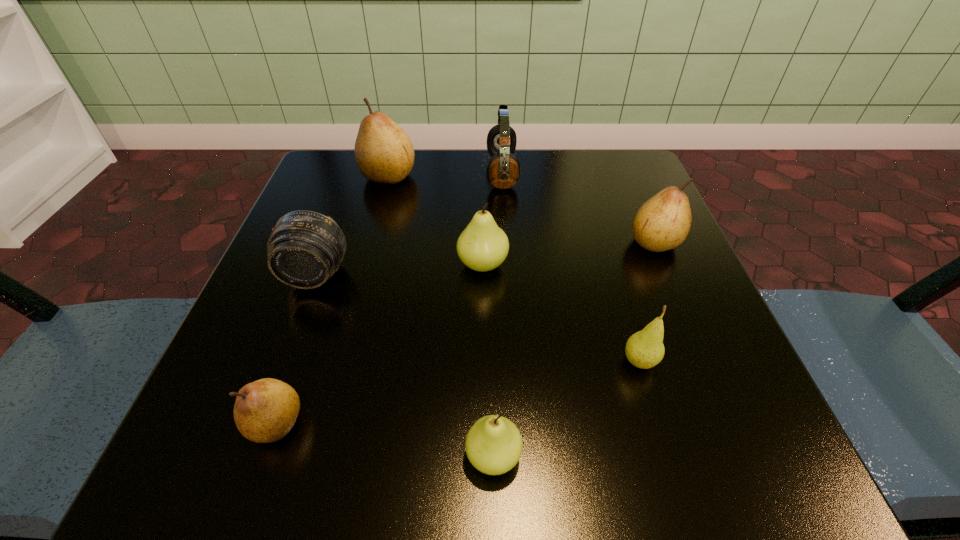
Identify the location of the nearer green pear. The height and width of the screenshot is (540, 960). (493, 445).

Locate an element on the screen. vacant space located on the front of the biggest brown pear is located at coordinates (368, 254).

The image size is (960, 540). What are the coordinates of `free location located on the ear cups of the headset` in the screenshot? It's located at (366, 172).

Where is `vacant space located on the ear cups of the headset`? The height and width of the screenshot is (540, 960). vacant space located on the ear cups of the headset is located at coordinates (415, 172).

Locate an element on the screen. This screenshot has width=960, height=540. vacant space located 0.180m on the ear cups of the headset is located at coordinates (406, 172).

Where is `vacant area situated 0.140m on the left of the rightmost object`? Image resolution: width=960 pixels, height=540 pixels. vacant area situated 0.140m on the left of the rightmost object is located at coordinates (552, 242).

Identify the location of vacant point located 0.260m on the back of the farther green pear. Image resolution: width=960 pixels, height=540 pixels. (482, 171).

This screenshot has width=960, height=540. What are the coordinates of `blank space located 0.090m at the front element of the telephoto lens` in the screenshot? It's located at (292, 338).

Locate an element on the screen. The width and height of the screenshot is (960, 540). vacant space situated 0.110m on the right of the sixth farthest object is located at coordinates (734, 362).

At what (x,y) coordinates should I click in order to perform the action: click on vacant space located 0.160m on the right of the nearest brown pear. Please return your answer as a coordinate pair (x, y). Looking at the image, I should click on (428, 423).